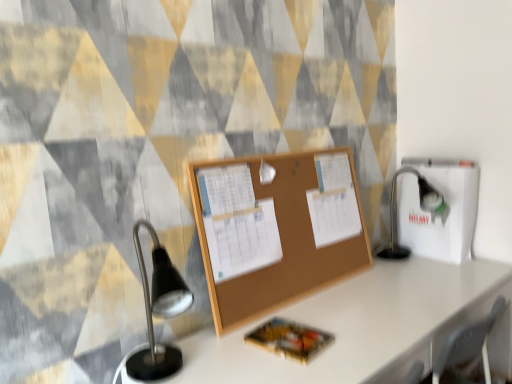
Question: Is black metal table lamp at right aimed at corkboard at center?

Choices:
 (A) yes
 (B) no

Answer: (B)

Question: Is corkboard at center at the back of black metal table lamp at right?

Choices:
 (A) no
 (B) yes

Answer: (A)

Question: Considering the relative sizes of black metal table lamp at right and corkboard at center in the image provided, is black metal table lamp at right shorter than corkboard at center?

Choices:
 (A) yes
 (B) no

Answer: (A)

Question: From the image's perspective, is black metal table lamp at right on top of corkboard at center?

Choices:
 (A) no
 (B) yes

Answer: (A)

Question: Does black metal table lamp at right have a greater height compared to corkboard at center?

Choices:
 (A) yes
 (B) no

Answer: (B)

Question: From the image's perspective, is black metal table lamp at right below corkboard at center?

Choices:
 (A) no
 (B) yes

Answer: (B)

Question: Considering the relative sizes of white cardboard box at right and corkboard at center in the image provided, is white cardboard box at right taller than corkboard at center?

Choices:
 (A) yes
 (B) no

Answer: (B)

Question: Can you confirm if white cardboard box at right is bigger than corkboard at center?

Choices:
 (A) yes
 (B) no

Answer: (A)

Question: Does white cardboard box at right have a lesser height compared to corkboard at center?

Choices:
 (A) yes
 (B) no

Answer: (A)

Question: Is white cardboard box at right at the left side of corkboard at center?

Choices:
 (A) yes
 (B) no

Answer: (B)

Question: Considering the relative positions of white cardboard box at right and corkboard at center in the image provided, is white cardboard box at right in front of corkboard at center?

Choices:
 (A) yes
 (B) no

Answer: (B)

Question: Is white cardboard box at right next to corkboard at center and touching it?

Choices:
 (A) yes
 (B) no

Answer: (B)

Question: From a real-world perspective, is black metal table lamp at right located beneath white cardboard box at right?

Choices:
 (A) no
 (B) yes

Answer: (B)